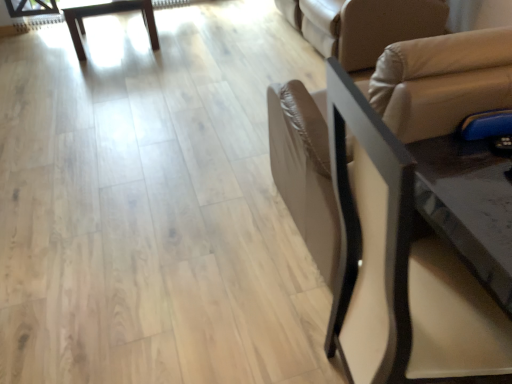
Question: Does wooden table at upper left turn towards beige leather futon at upper right?

Choices:
 (A) no
 (B) yes

Answer: (A)

Question: Does wooden table at upper left have a larger size compared to beige leather futon at upper right?

Choices:
 (A) no
 (B) yes

Answer: (A)

Question: From a real-world perspective, is wooden table at upper left beneath beige leather futon at upper right?

Choices:
 (A) yes
 (B) no

Answer: (A)

Question: Does wooden table at upper left lie behind beige leather futon at upper right?

Choices:
 (A) no
 (B) yes

Answer: (B)

Question: Is the surface of wooden table at upper left in direct contact with beige leather futon at upper right?

Choices:
 (A) yes
 (B) no

Answer: (B)

Question: From a real-world perspective, is wooden table at upper left positioned above or below black leather chair at right?

Choices:
 (A) above
 (B) below

Answer: (B)

Question: Is wooden table at upper left in front of or behind black leather chair at right in the image?

Choices:
 (A) behind
 (B) front

Answer: (A)

Question: Is wooden table at upper left spatially inside black leather chair at right, or outside of it?

Choices:
 (A) outside
 (B) inside

Answer: (A)

Question: Considering the positions of point (82, 59) and point (360, 180), is point (82, 59) closer or farther from the camera than point (360, 180)?

Choices:
 (A) closer
 (B) farther

Answer: (B)

Question: Considering the positions of black leather chair at right and wooden table at upper left in the image, is black leather chair at right taller or shorter than wooden table at upper left?

Choices:
 (A) short
 (B) tall

Answer: (B)

Question: Would you say black leather chair at right is inside or outside wooden table at upper left?

Choices:
 (A) inside
 (B) outside

Answer: (B)

Question: In the image, is black leather chair at right on the left side or the right side of wooden table at upper left?

Choices:
 (A) left
 (B) right

Answer: (B)

Question: From a real-world perspective, is black leather chair at right positioned above or below wooden table at upper left?

Choices:
 (A) above
 (B) below

Answer: (A)

Question: From the image's perspective, is beige leather futon at upper right positioned above or below black leather chair at right?

Choices:
 (A) above
 (B) below

Answer: (A)

Question: Which is correct: beige leather futon at upper right is inside black leather chair at right, or outside of it?

Choices:
 (A) outside
 (B) inside

Answer: (A)